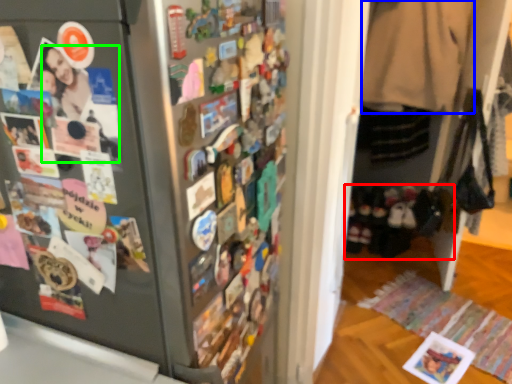
Question: Estimate the real-world distances between objects in this image. Which object is closer to footwear (highlighted by a red box), clothing (highlighted by a blue box) or person (highlighted by a green box)?

Choices:
 (A) clothing
 (B) person

Answer: (A)